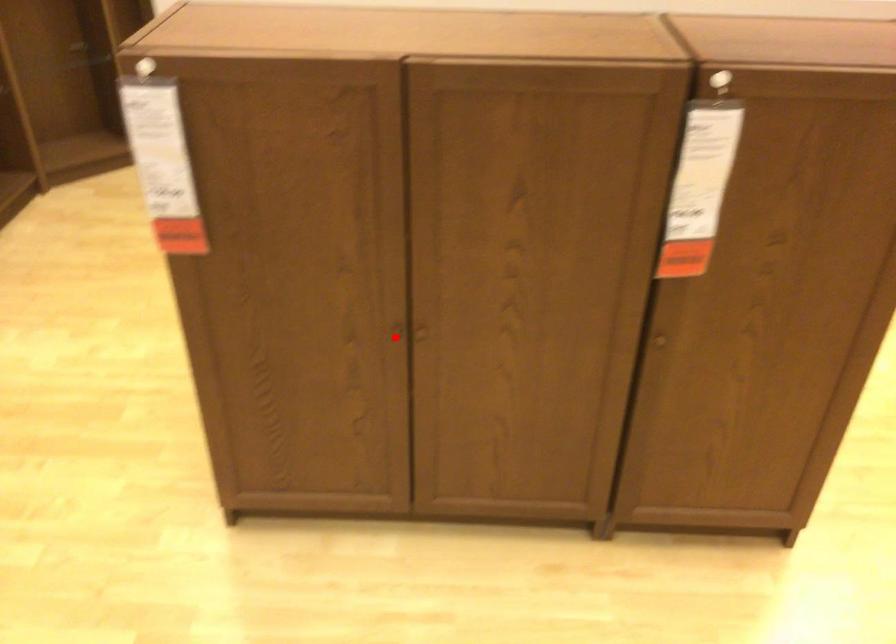
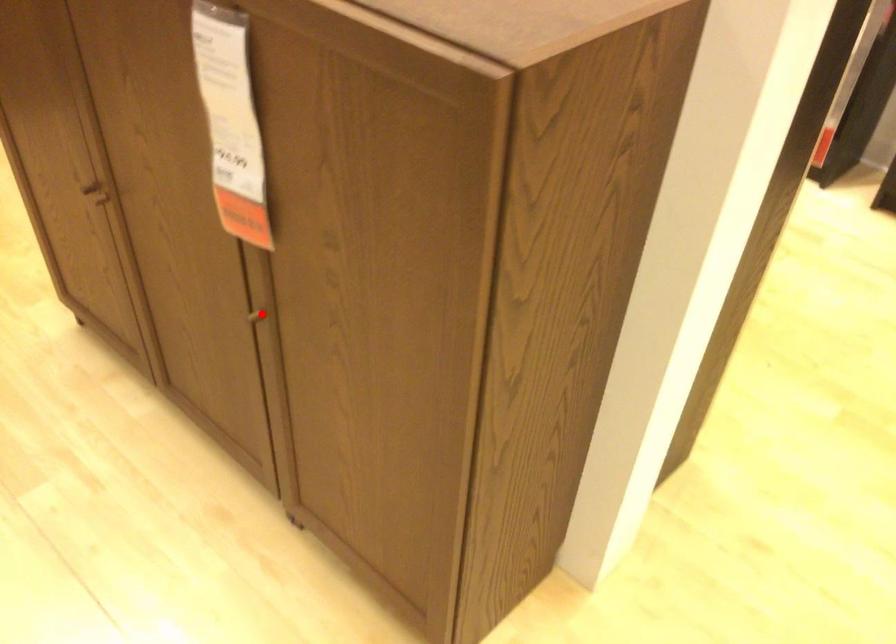
I am providing you with two images of the same scene from different viewpoints. A red point is marked on the first image and another point is marked on the second image. Does the point marked in image1 correspond to the same location as the one in image2?

No